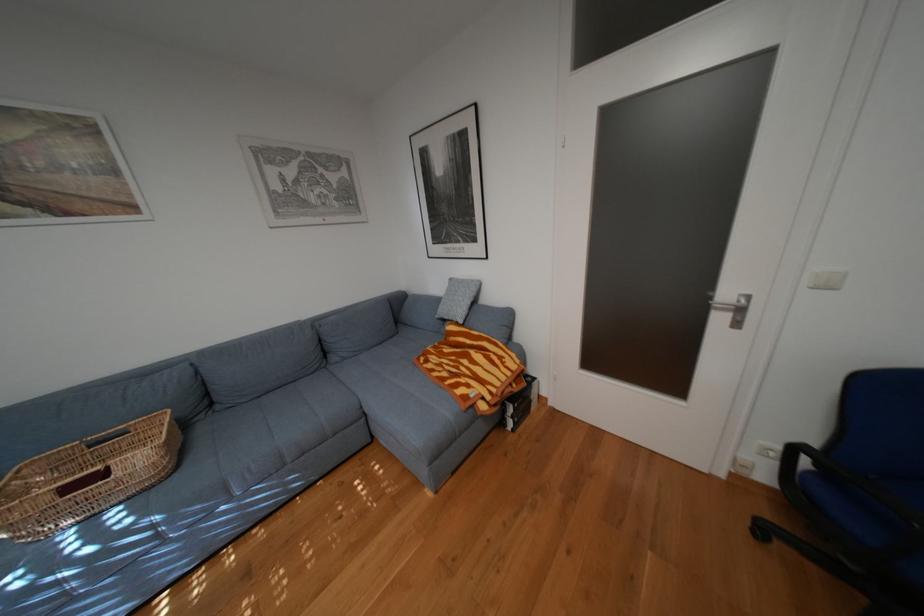
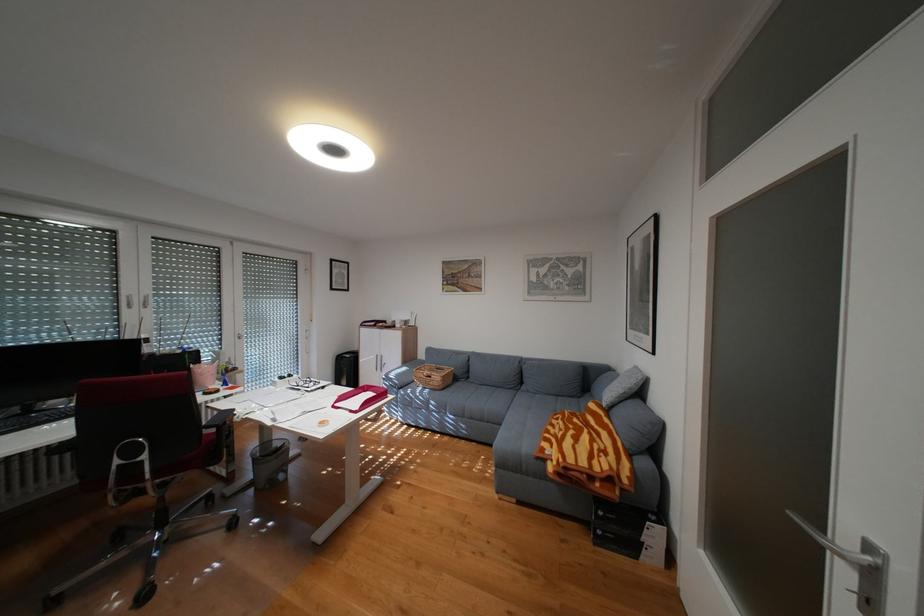
Where in the second image is the point corresponding to (x=480, y=386) from the first image?

(564, 445)